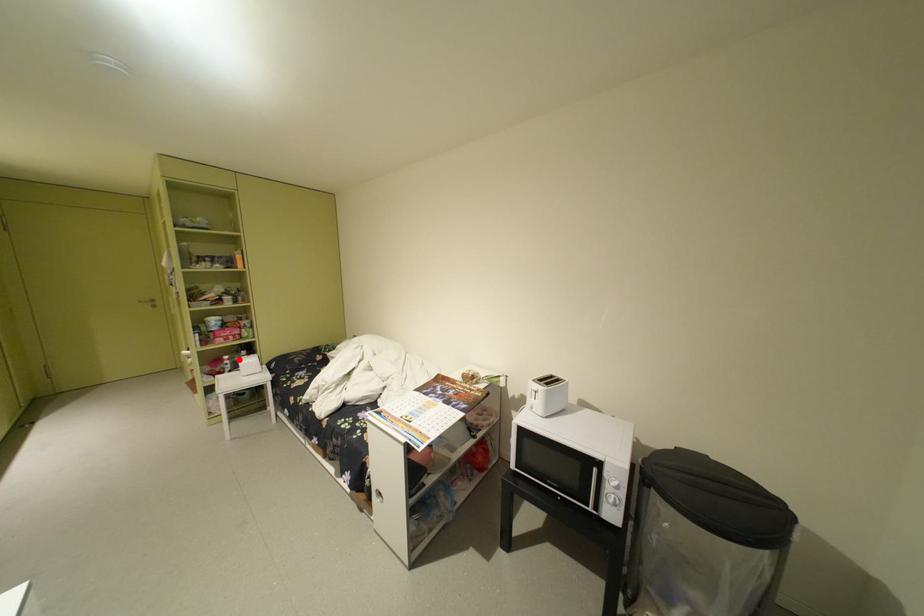
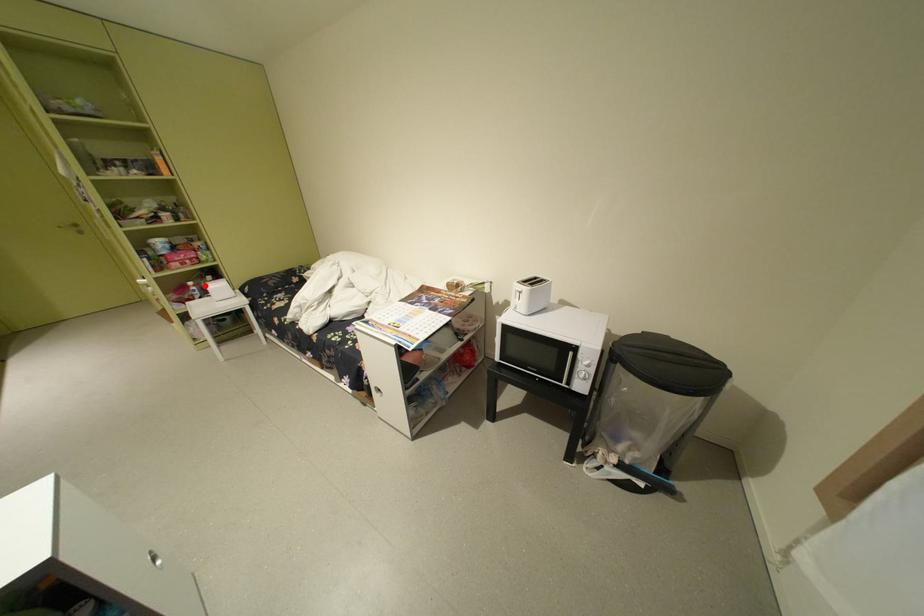
I am providing you with two images of the same scene from different viewpoints. A red point is marked on the first image and another point is marked on the second image. Do the highlighted points in image1 and image2 indicate the same real-world spot?

Yes